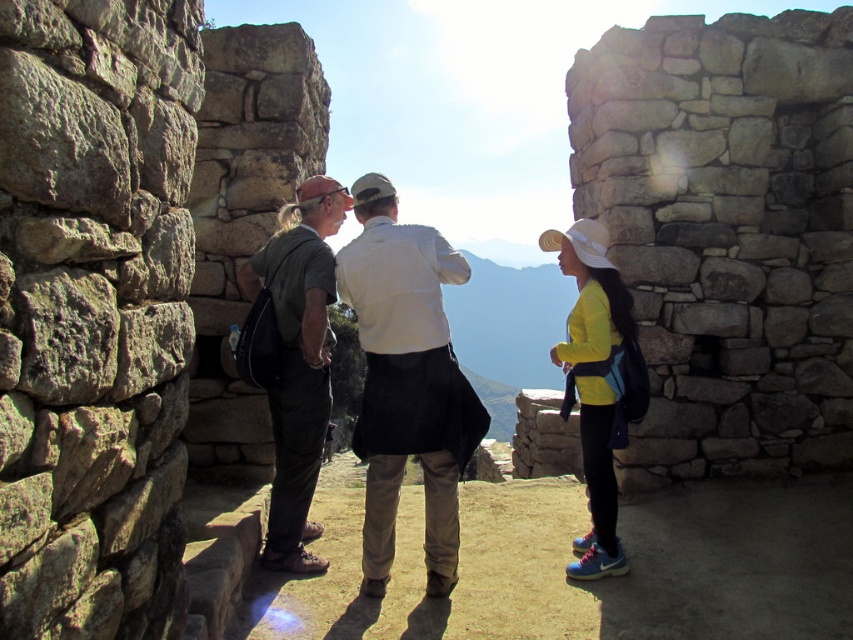
Question: Is matte black jacket at center positioned at the back of white matte shirt at center?

Choices:
 (A) no
 (B) yes

Answer: (B)

Question: Does white matte shirt at center have a larger size compared to yellow matte jacket at center?

Choices:
 (A) no
 (B) yes

Answer: (B)

Question: Which object is the closest to the matte black jacket at center?

Choices:
 (A) dark gray fabric shirt at center
 (B) yellow matte jacket at center

Answer: (A)

Question: Which point is closer to the camera?

Choices:
 (A) (376, 188)
 (B) (368, 467)
 (C) (277, 308)
 (D) (608, 490)

Answer: (B)

Question: Among these points, which one is farthest from the camera?

Choices:
 (A) click(x=477, y=413)
 (B) click(x=306, y=429)
 (C) click(x=628, y=371)

Answer: (C)

Question: Does dark gray fabric shirt at center appear on the right side of yellow matte jacket at center?

Choices:
 (A) no
 (B) yes

Answer: (A)